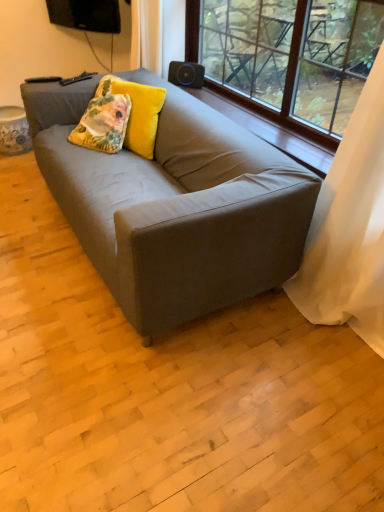
What do you see at coordinates (270, 132) in the screenshot?
I see `wooden at upper center` at bounding box center [270, 132].

Find the location of a particular element. The height and width of the screenshot is (512, 384). white sheer curtain at right is located at coordinates (349, 228).

Describe the element at coordinates (317, 71) in the screenshot. This screenshot has height=512, width=384. I see `transparent glass window at upper center` at that location.

Find the location of a particular element. Image resolution: width=384 pixels, height=512 pixels. floral-patterned velvet pillow at center is located at coordinates (137, 112).

Does white sheer curtain at right have a smaller size compared to floral-patterned velvet pillow at upper left?

No.

From the image's perspective, is white sheer curtain at right located above or below floral-patterned velvet pillow at upper left?

From the image's perspective, white sheer curtain at right appears below floral-patterned velvet pillow at upper left.

Is point (233, 105) closer to viewer compared to point (285, 114)?

No, (233, 105) is further to viewer.

Is there a large distance between wooden at upper center and transparent glass window at upper center?

That's not correct — wooden at upper center is a little close to transparent glass window at upper center.

Is wooden at upper center thinner than transparent glass window at upper center?

Incorrect, the width of wooden at upper center is not less than that of transparent glass window at upper center.

From a real-world perspective, which object rests below the other?

In real-world perspective, wooden at upper center is lower.

Is floral-patterned velvet pillow at center positioned beyond the bounds of white sheer curtain at right?

Yes, floral-patterned velvet pillow at center is outside of white sheer curtain at right.

Does floral-patterned velvet pillow at center have a larger size compared to white sheer curtain at right?

Actually, floral-patterned velvet pillow at center might be smaller than white sheer curtain at right.

How distant is floral-patterned velvet pillow at center from white sheer curtain at right?

They are 1.21 meters apart.

Is floral-patterned velvet pillow at center not close to white sheer curtain at right?

Absolutely, floral-patterned velvet pillow at center is distant from white sheer curtain at right.

Is transparent glass window at upper center shorter than wooden at upper center?

Incorrect, the height of transparent glass window at upper center does not fall short of that of wooden at upper center.

Can you tell me how much transparent glass window at upper center and wooden at upper center differ in facing direction?

They differ by 0.00411 degrees in their facing directions.

Locate an element on the screen. window sill behind the transparent glass window at upper center is located at coordinates (270, 132).

In the scene shown: Would you say transparent glass window at upper center is outside wooden at upper center?

Indeed, transparent glass window at upper center is completely outside wooden at upper center.

Is matte gray couch at center turned away from transparent glass window at upper center?

No, matte gray couch at center is not facing the opposite direction of transparent glass window at upper center.

Considering the sizes of matte gray couch at center and transparent glass window at upper center in the image, is matte gray couch at center wider or thinner than transparent glass window at upper center?

In the image, matte gray couch at center appears to be wider than transparent glass window at upper center.

From a real-world perspective, does matte gray couch at center sit lower than transparent glass window at upper center?

Yes.

From the image's perspective, which is above, matte gray couch at center or transparent glass window at upper center?

transparent glass window at upper center is shown above in the image.

How many degrees apart are the facing directions of wooden at upper center and white sheer curtain at right?

0.0726 degrees separate the facing orientations of wooden at upper center and white sheer curtain at right.

Considering the relative positions of wooden at upper center and white sheer curtain at right in the image provided, is wooden at upper center behind white sheer curtain at right?

Yes, wooden at upper center is behind white sheer curtain at right.

Considering the relative positions of wooden at upper center and white sheer curtain at right in the image provided, is wooden at upper center to the right of white sheer curtain at right from the viewer's perspective?

In fact, wooden at upper center is to the left of white sheer curtain at right.

Between wooden at upper center and white sheer curtain at right, which one has more height?

With more height is white sheer curtain at right.

In the scene shown: Which of these two, floral-patterned velvet pillow at upper left or floral-patterned velvet pillow at center, is bigger?

Bigger between the two is floral-patterned velvet pillow at center.

Is floral-patterned velvet pillow at center located within floral-patterned velvet pillow at upper left?

No, floral-patterned velvet pillow at center is not surrounded by floral-patterned velvet pillow at upper left.

Does point (111, 97) lie behind point (148, 152)?

Yes, point (111, 97) is farther from viewer.

Where is `curtain located below the floral-patterned velvet pillow at upper left (from the image's perspective)`? curtain located below the floral-patterned velvet pillow at upper left (from the image's perspective) is located at coordinates (349, 228).

This screenshot has height=512, width=384. In order to click on window in front of the wooden at upper center in this screenshot , I will do `click(317, 71)`.

From the image, which object appears to be nearer to wooden at upper center, floral-patterned velvet pillow at upper left or floral-patterned velvet pillow at center?

Among the two, floral-patterned velvet pillow at center is located nearer to wooden at upper center.

Which object lies nearer to the anchor point floral-patterned velvet pillow at center, matte gray couch at center or transparent glass window at upper center?

The object closer to floral-patterned velvet pillow at center is matte gray couch at center.

Considering their positions, is white sheer curtain at right positioned closer to floral-patterned velvet pillow at upper left than matte gray couch at center?

matte gray couch at center is closer to floral-patterned velvet pillow at upper left.

When comparing their distances from floral-patterned velvet pillow at upper left, does matte gray couch at center or white sheer curtain at right seem further?

Based on the image, white sheer curtain at right appears to be further to floral-patterned velvet pillow at upper left.

Estimate the real-world distances between objects in this image. Which object is further from matte gray couch at center, floral-patterned velvet pillow at upper left or white sheer curtain at right?

white sheer curtain at right is further to matte gray couch at center.

Considering their positions, is floral-patterned velvet pillow at center positioned closer to white sheer curtain at right than matte gray couch at center?

Based on the image, matte gray couch at center appears to be nearer to white sheer curtain at right.

From the image, which object appears to be farther from wooden at upper center, transparent glass window at upper center or matte gray couch at center?

Based on the image, transparent glass window at upper center appears to be further to wooden at upper center.

Which object lies further to the anchor point matte gray couch at center, transparent glass window at upper center or floral-patterned velvet pillow at center?

transparent glass window at upper center is further to matte gray couch at center.

You are a GUI agent. You are given a task and a screenshot of the screen. Output one action in this format:
    pyautogui.click(x=<x>, y=<y>)
    Task: Click on the pillow positioned between white sheer curtain at right and floral-patterned velvet pillow at upper left from near to far
    
    Given the screenshot: What is the action you would take?
    pyautogui.click(x=137, y=112)

I want to click on window sill between matte gray couch at center and floral-patterned velvet pillow at upper left in the front-back direction, so click(x=270, y=132).

The width and height of the screenshot is (384, 512). I want to click on window sill between floral-patterned velvet pillow at upper left and transparent glass window at upper center, so click(270, 132).

Identify the location of window sill between white sheer curtain at right and floral-patterned velvet pillow at upper left in the front-back direction. (270, 132).